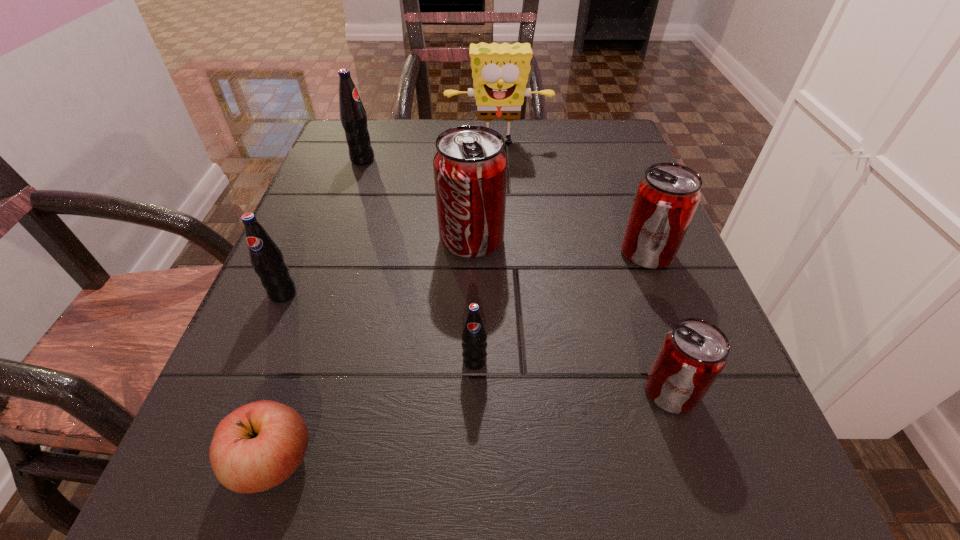
The width and height of the screenshot is (960, 540). I want to click on free spot between the rightmost black pop and the nearest red pop soda, so click(572, 376).

Locate an element on the screen. vacant area that lies between the biggest red pop soda and the farthest pop is located at coordinates (418, 200).

You are a GUI agent. You are given a task and a screenshot of the screen. Output one action in this format:
    pyautogui.click(x=<x>, y=<y>)
    Task: Click on the fifth closest object to the leftmost pop
    The width and height of the screenshot is (960, 540).
    Given the screenshot: What is the action you would take?
    pyautogui.click(x=500, y=72)

Locate an element on the screen. The height and width of the screenshot is (540, 960). object identified as the fifth closest to the nearest red pop soda is located at coordinates (266, 257).

Identify which pop is the third closest to the nearest red pop soda. Please provide its 2D coordinates. Your answer should be formatted as a tuple, i.e. [(x, y)], where the tuple contains the x and y coordinates of a point satisfying the conditions above.

[(470, 164)]

Locate which pop is the third closest to the red apple. Please provide its 2D coordinates. Your answer should be formatted as a tuple, i.e. [(x, y)], where the tuple contains the x and y coordinates of a point satisfying the conditions above.

[(470, 164)]

I want to click on black pop that stands as the second closest to the fifth pop from right to left, so click(x=474, y=335).

Point out which black pop is positioned as the second nearest to the yellow sponge. Please provide its 2D coordinates. Your answer should be formatted as a tuple, i.e. [(x, y)], where the tuple contains the x and y coordinates of a point satisfying the conditions above.

[(266, 257)]

Where is `red pop soda that is the second closest to the nearest red pop soda`? red pop soda that is the second closest to the nearest red pop soda is located at coordinates (470, 164).

Identify which red pop soda is the second nearest to the leftmost red pop soda. Please provide its 2D coordinates. Your answer should be formatted as a tuple, i.e. [(x, y)], where the tuple contains the x and y coordinates of a point satisfying the conditions above.

[(694, 352)]